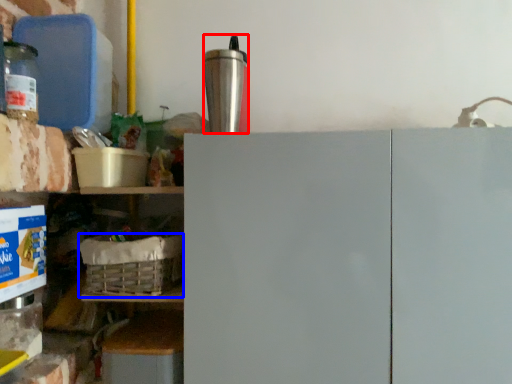
Question: Which object is closer to the camera taking this photo, appliance (highlighted by a red box) or basket (highlighted by a blue box)?

Choices:
 (A) appliance
 (B) basket

Answer: (A)